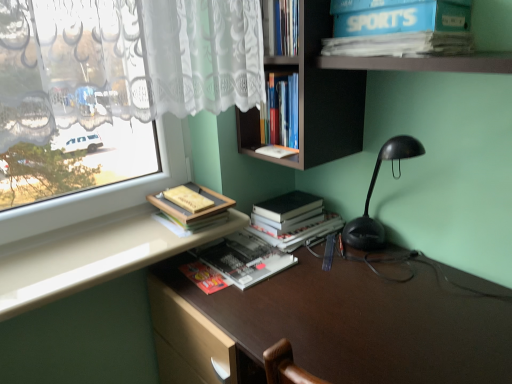
Locate an element on the screen. The width and height of the screenshot is (512, 384). vacant space in front of hardcover black book at center, positioned as the 3th book in top-to-bottom order is located at coordinates (332, 268).